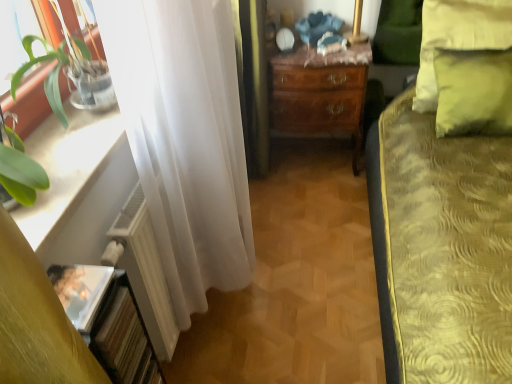
Where is `vacant space in green leafy plant at left (from a real-world perspective)`? vacant space in green leafy plant at left (from a real-world perspective) is located at coordinates (57, 195).